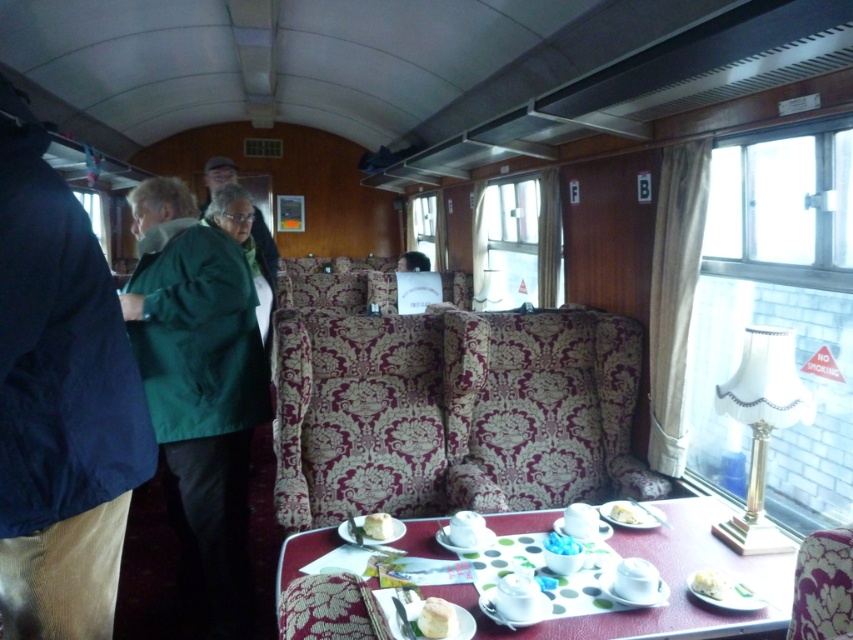
Question: Does green fabric jacket at left have a smaller size compared to white creamy cake at lower right?

Choices:
 (A) yes
 (B) no

Answer: (B)

Question: Which is nearer to the polished wood table at center?

Choices:
 (A) dark blue fabric coat at left
 (B) white fluffy bread at table center
 (C) green fabric jacket at left

Answer: (B)

Question: Based on their relative distances, which object is farther from the white fluffy bread at table center?

Choices:
 (A) green fabric jacket at left
 (B) smooth cream cake at table center

Answer: (A)

Question: Which of these objects is positioned farthest from the smooth white cream at center?

Choices:
 (A) polished wood table at center
 (B) green fabric jacket at left

Answer: (B)

Question: Does dark blue fabric coat at left have a greater width compared to white creamy cake at lower right?

Choices:
 (A) no
 (B) yes

Answer: (B)

Question: Is green fabric jacket at left below white creamy cake at lower right?

Choices:
 (A) yes
 (B) no

Answer: (B)